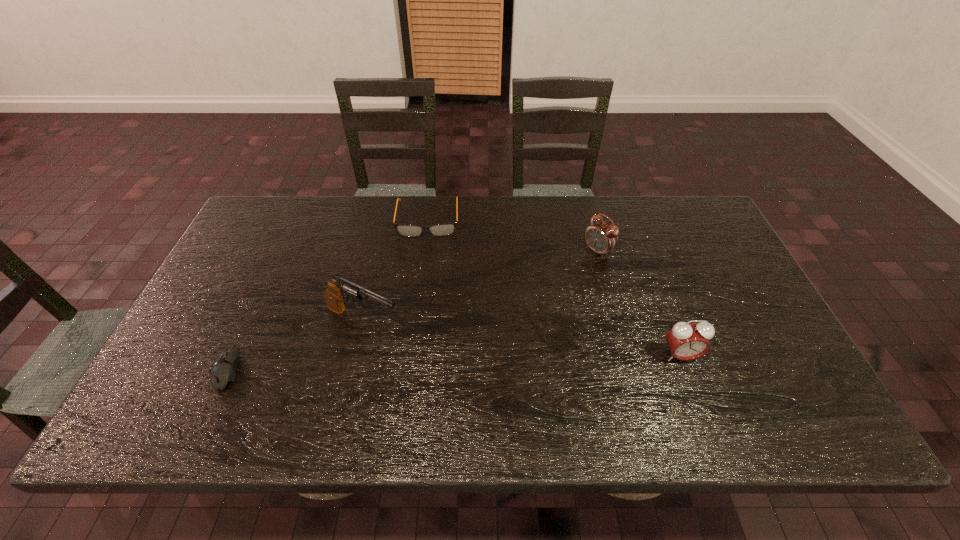
Identify the location of spectacles present at the far edge. This screenshot has height=540, width=960. (442, 229).

What are the coordinates of `alarm clock located at the far edge` in the screenshot? It's located at (601, 237).

Where is `computer mouse that is at the near edge`? Image resolution: width=960 pixels, height=540 pixels. computer mouse that is at the near edge is located at coordinates (223, 370).

I want to click on alarm clock that is positioned at the near edge, so click(687, 341).

This screenshot has width=960, height=540. In order to click on object at the left edge in this screenshot , I will do `click(223, 370)`.

Find the location of a particular element. The width and height of the screenshot is (960, 540). object located in the near left corner section of the desktop is located at coordinates (223, 370).

The width and height of the screenshot is (960, 540). What are the coordinates of `vacant space at the far edge of the desktop` in the screenshot? It's located at (641, 217).

Image resolution: width=960 pixels, height=540 pixels. In the image, there is a desktop. Identify the location of free space at the near edge. (579, 368).

Where is `free space at the left edge of the desktop`? This screenshot has width=960, height=540. free space at the left edge of the desktop is located at coordinates (214, 285).

Find the location of a particular element. vacant space at the right edge of the desktop is located at coordinates (756, 345).